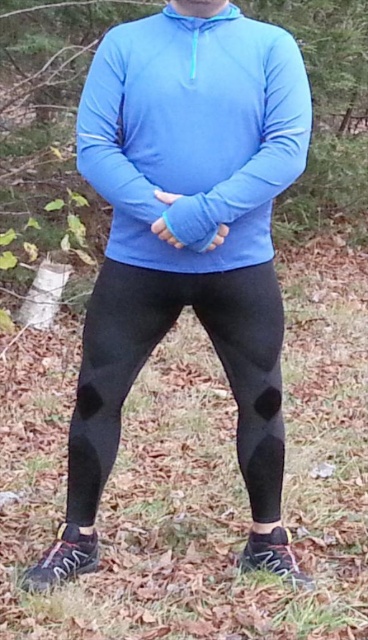
Between matte blue sweatshirt at center and black mesh leggings at center, which one appears on the left side from the viewer's perspective?

From the viewer's perspective, black mesh leggings at center appears more on the left side.

Which of these two, matte blue sweatshirt at center or black mesh leggings at center, stands shorter?

Standing shorter between the two is matte blue sweatshirt at center.

This screenshot has height=640, width=368. Describe the element at coordinates (193, 134) in the screenshot. I see `matte blue sweatshirt at center` at that location.

At what (x,y) coordinates should I click in order to perform the action: click on matte blue sweatshirt at center. Please return your answer as a coordinate pair (x, y). This screenshot has width=368, height=640. Looking at the image, I should click on (193, 134).